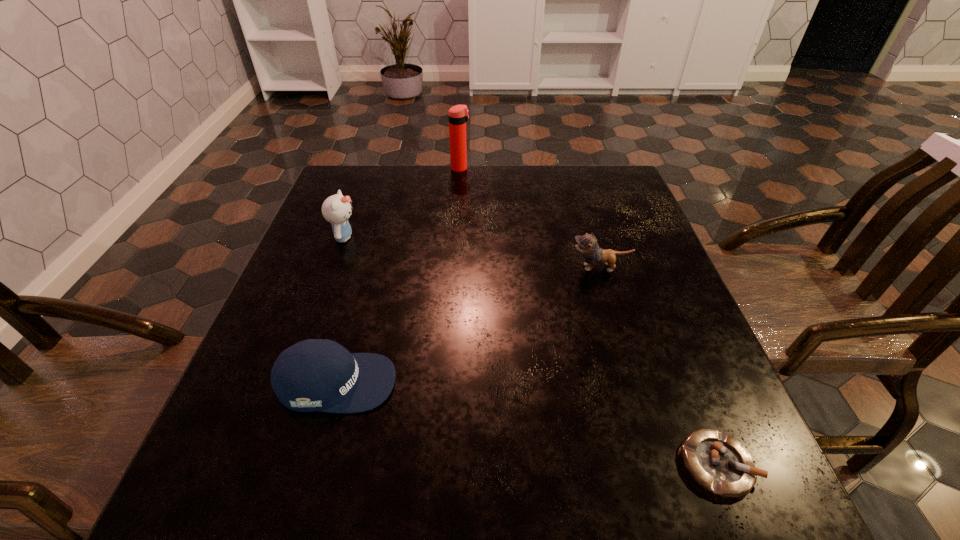
The height and width of the screenshot is (540, 960). Identify the location of the tallest object. (458, 115).

This screenshot has width=960, height=540. What are the coordinates of `the farthest object` in the screenshot? It's located at (458, 115).

Locate an element on the screen. the second farthest object is located at coordinates (336, 209).

The width and height of the screenshot is (960, 540). In order to click on the taller kitten in this screenshot , I will do `click(336, 209)`.

The height and width of the screenshot is (540, 960). Find the location of `the right kitten`. the right kitten is located at coordinates (587, 244).

Image resolution: width=960 pixels, height=540 pixels. What are the coordinates of `the nearer kitten` in the screenshot? It's located at (587, 244).

In order to click on baseball cap in this screenshot , I will do `click(312, 375)`.

Locate an element on the screen. The image size is (960, 540). the second nearest object is located at coordinates (312, 375).

This screenshot has width=960, height=540. Find the location of `ashtray`. ashtray is located at coordinates 718,463.

Find the location of `the nearest object`. the nearest object is located at coordinates (718, 463).